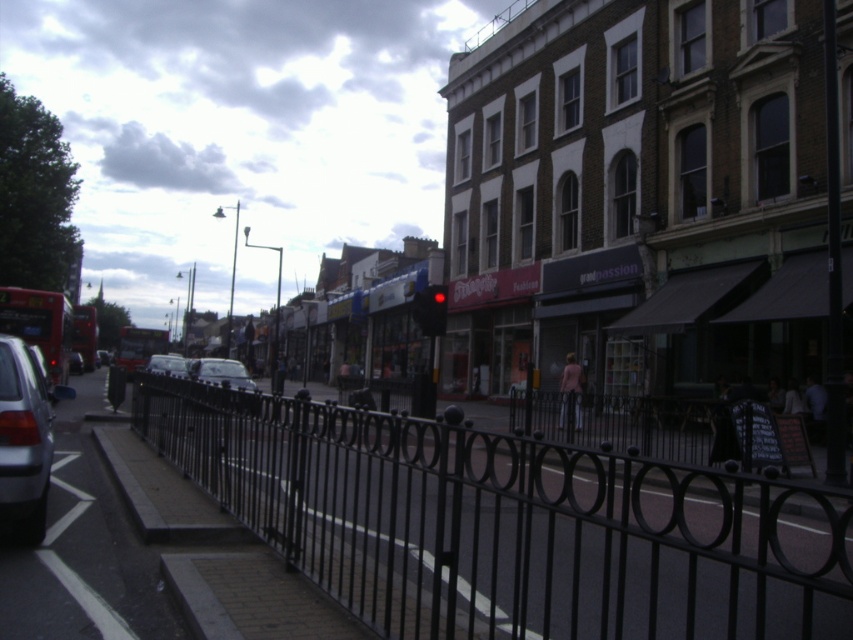
Question: Which point is farther to the camera?

Choices:
 (A) (225, 362)
 (B) (0, 454)
 (C) (152, 364)

Answer: (C)

Question: Which point is closer to the camera taking this photo?

Choices:
 (A) [74, 496]
 (B) [196, 378]
 (C) [448, 497]
 (D) [12, 372]

Answer: (D)

Question: Is black wrought iron fence at center thinner than silver metallic car at left?

Choices:
 (A) no
 (B) yes

Answer: (A)

Question: Can you confirm if smooth concrete pavement at lower left is positioned to the right of shiny silver car at center?

Choices:
 (A) no
 (B) yes

Answer: (A)

Question: Which of the following is the farthest from the observer?

Choices:
 (A) silver metallic car at left
 (B) metallic silver car at center

Answer: (B)

Question: Is red metallic bus at left further to the viewer compared to metallic silver car at center?

Choices:
 (A) yes
 (B) no

Answer: (B)